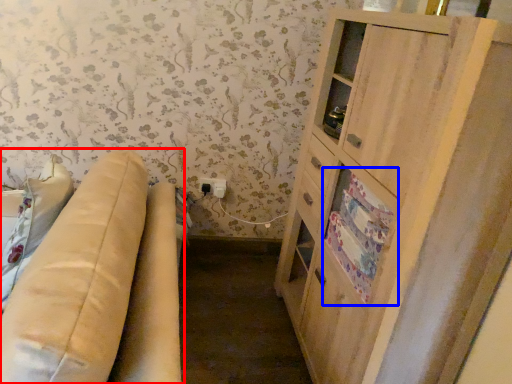
Question: Which object appears closest to the camera in this image, studio couch (highlighted by a red box) or drawer (highlighted by a blue box)?

Choices:
 (A) studio couch
 (B) drawer

Answer: (A)